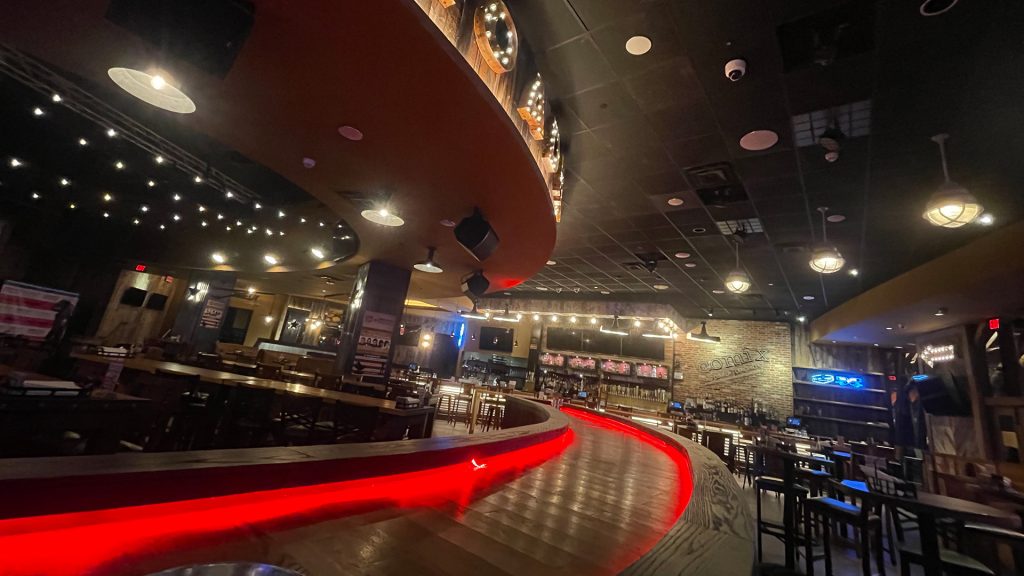
Locate an element on the screen. light is located at coordinates (424, 266).